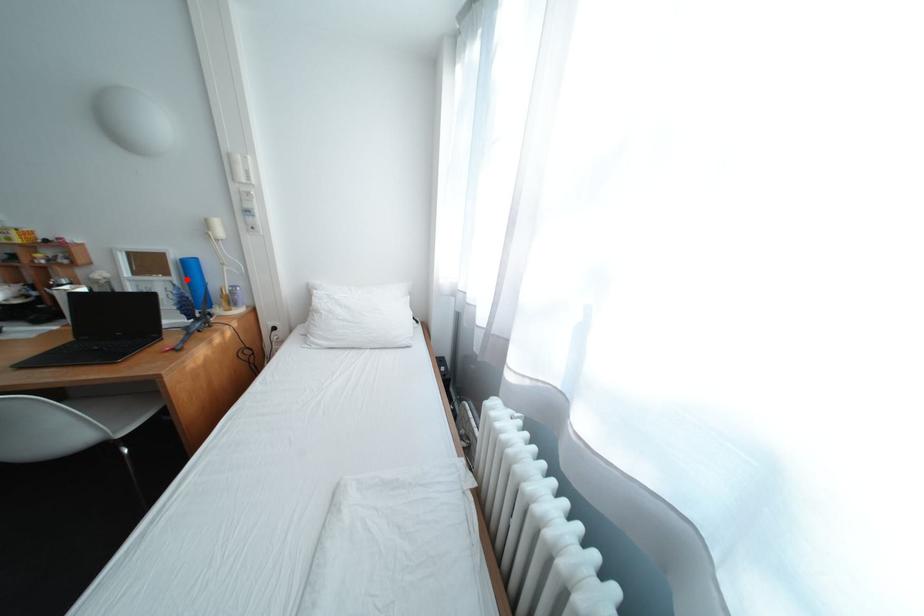
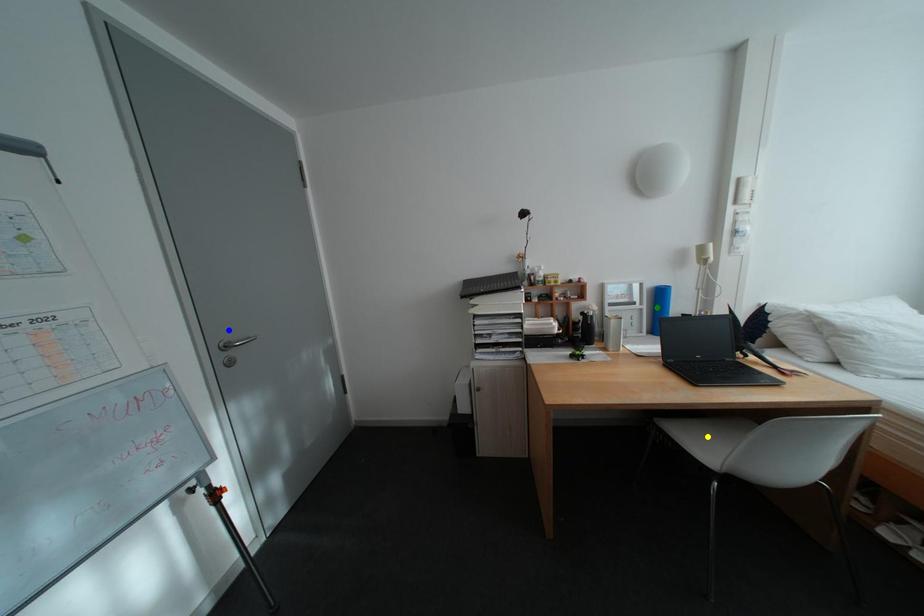
Question: I am providing you with two images of the same scene from different viewpoints. A red point is marked on the first image. You are given multiple points on the second image. Which mark in image 2 goes with the point in image 1?

Choices:
 (A) yellow point
 (B) blue point
 (C) green point

Answer: (C)